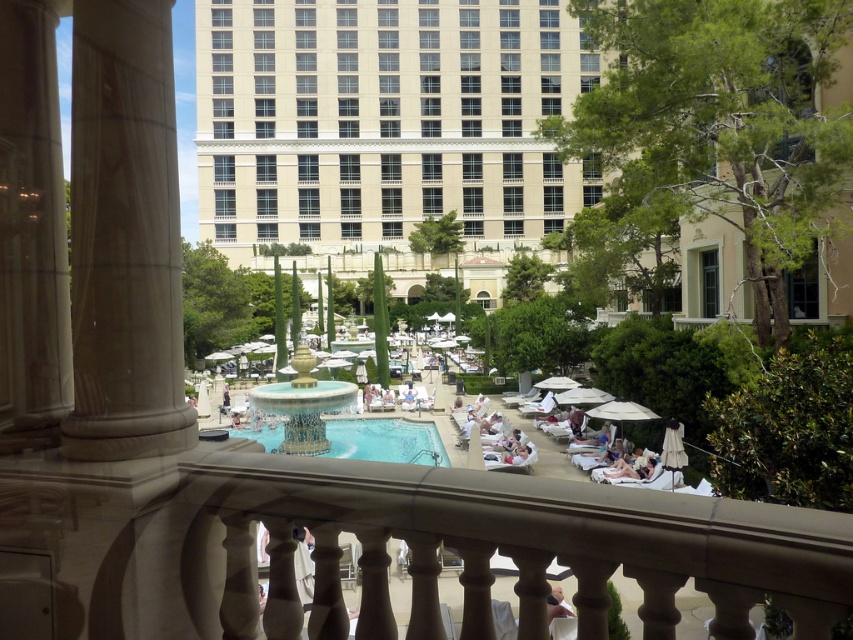
Question: Does smooth stone railing at center have a lesser width compared to gold metallic fountain at center?

Choices:
 (A) yes
 (B) no

Answer: (B)

Question: Which point is farther to the camera?

Choices:
 (A) (519, 525)
 (B) (577, 77)
 (C) (572, 611)
 (D) (415, 452)

Answer: (B)

Question: Which object is positioned farthest from the smooth stone railing at center?

Choices:
 (A) clear glass pool at center
 (B) beige/smooth/facade at upper center
 (C) smooth beige towel at lower center
 (D) gold metallic fountain at center

Answer: (B)

Question: Can you confirm if clear glass pool at center is wider than gold metallic fountain at center?

Choices:
 (A) no
 (B) yes

Answer: (B)

Question: Is clear glass pool at center bigger than gold metallic fountain at center?

Choices:
 (A) no
 (B) yes

Answer: (A)

Question: Based on their relative distances, which object is farther from the smooth stone railing at center?

Choices:
 (A) beige/smooth/facade at upper center
 (B) clear glass pool at center
 (C) gold metallic fountain at center
 (D) smooth beige towel at lower center

Answer: (A)